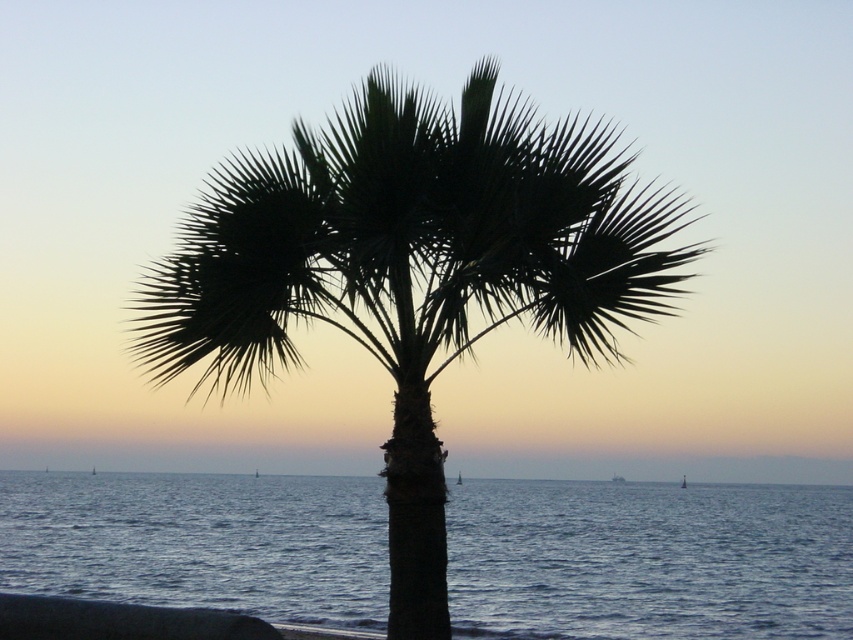
You are standing at the point with coordinates point (412, 269). You want to walk towards the silhouette leafy palm at center. Which direction should you go?

The silhouette leafy palm at center is located at point 0.484, so you are already at the location of the silhouette leafy palm at center.

Consider the image. You are an artist trying to sketch this scene. You want to ensure the silhouette leafy palm at center and dark blue water at center are proportionally accurate. Based on the scene description, which object should you draw wider in your sketch?

The dark blue water at center should be drawn wider since the silhouette leafy palm at center has a smaller width compared to it according to the description.